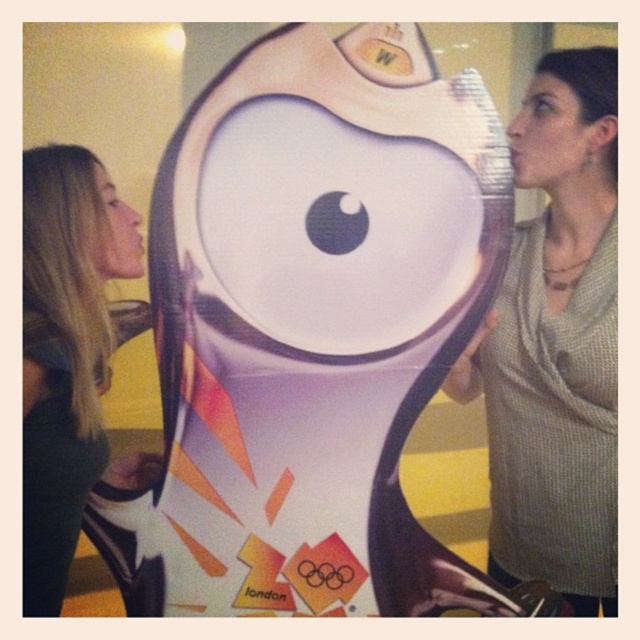
The height and width of the screenshot is (640, 640). What do you see at coordinates (556, 342) in the screenshot?
I see `matte gray sweater at right` at bounding box center [556, 342].

Between matte gray sweater at right and blonde hair at left, which one is positioned higher?

matte gray sweater at right is above.

Where is `matte gray sweater at right`? matte gray sweater at right is located at coordinates (556, 342).

At what (x,y) coordinates should I click in order to perform the action: click on matte gray sweater at right. Please return your answer as a coordinate pair (x, y). Looking at the image, I should click on (556, 342).